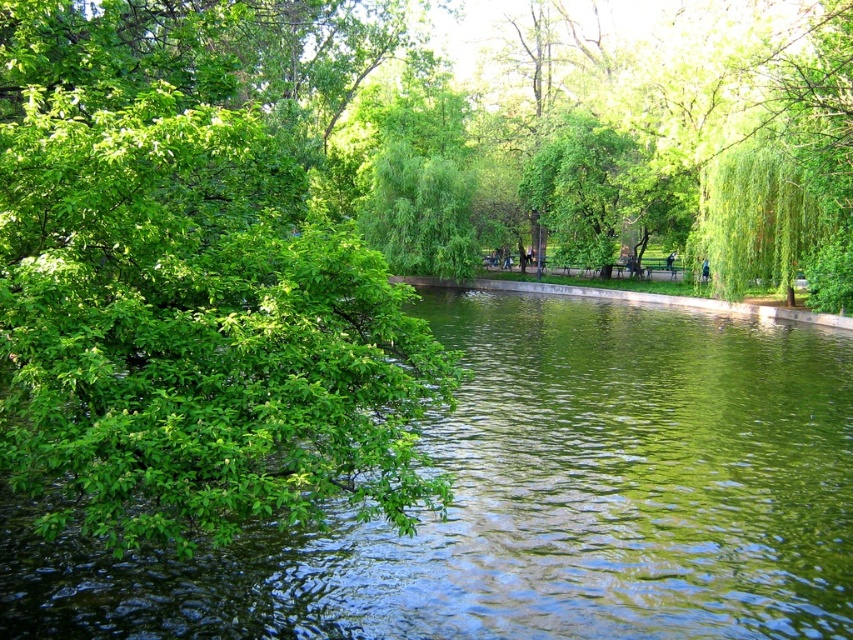
You are a bird looking for a nesting spot. You see the green leafy tree at left and the green leafy tree at center. Which tree would you choose if you prefer a taller tree for your nest?

The green leafy tree at left is much taller than the green leafy tree at center, so you should choose the green leafy tree at left for your nest.

Looking at this image, in the park scene, you see a green leafy tree at left and a green leafy tree at center. From your viewpoint, which tree is positioned further to the left?

The green leafy tree at left is positioned further to the left compared to the green leafy tree at center.